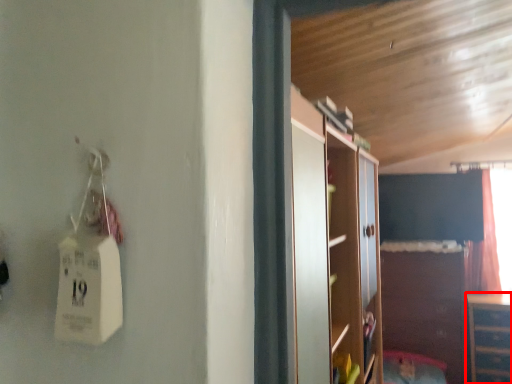
Question: Considering the relative positions of cabinetry (annotated by the red box) and cabinetry in the image provided, where is cabinetry (annotated by the red box) located with respect to the staircase?

Choices:
 (A) right
 (B) left

Answer: (A)